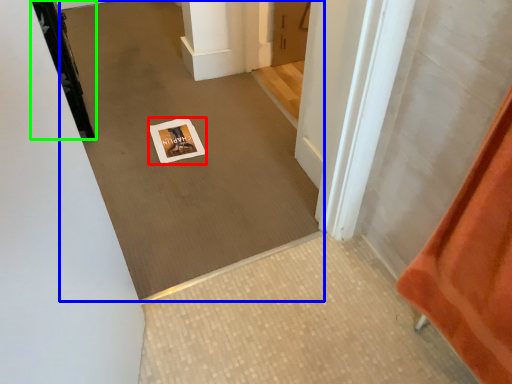
Question: Which is farther away from postcard (highlighted by a red box)? plain (highlighted by a blue box) or door (highlighted by a green box)?

Choices:
 (A) plain
 (B) door

Answer: (B)